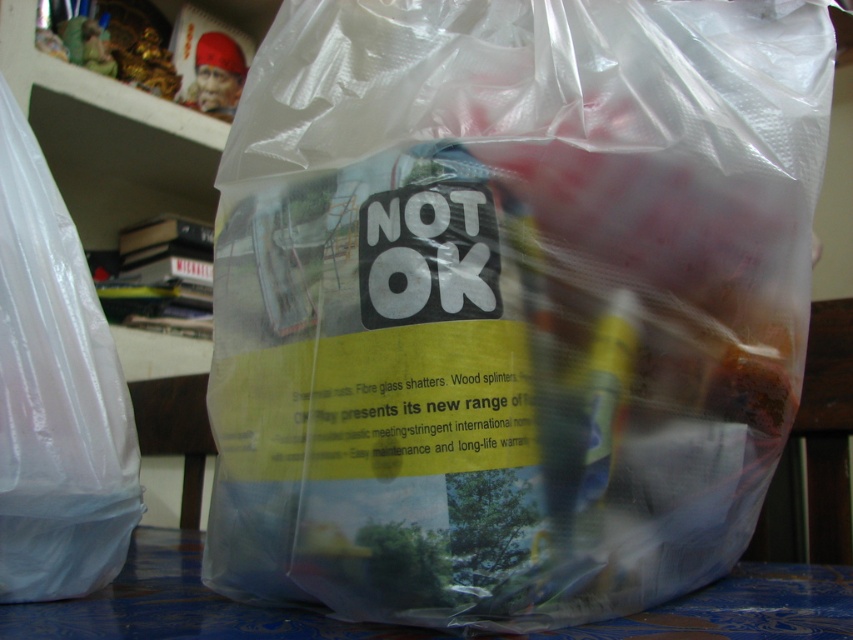
Question: Is transparent plastic bag at center positioned at the back of transparent plastic bag at left?

Choices:
 (A) yes
 (B) no

Answer: (B)

Question: Which point appears farthest from the camera in this image?

Choices:
 (A) (444, 625)
 (B) (254, 636)
 (C) (62, 472)

Answer: (C)

Question: Does transparent plastic bag at center have a greater width compared to blue fabric table at lower center?

Choices:
 (A) yes
 (B) no

Answer: (B)

Question: Among these objects, which one is nearest to the camera?

Choices:
 (A) transparent plastic bag at center
 (B) transparent plastic bag at left
 (C) blue fabric table at lower center

Answer: (A)

Question: Can you confirm if transparent plastic bag at center is positioned above transparent plastic bag at left?

Choices:
 (A) no
 (B) yes

Answer: (B)

Question: Which object is positioned farthest from the transparent plastic bag at center?

Choices:
 (A) blue fabric table at lower center
 (B) transparent plastic bag at left

Answer: (B)